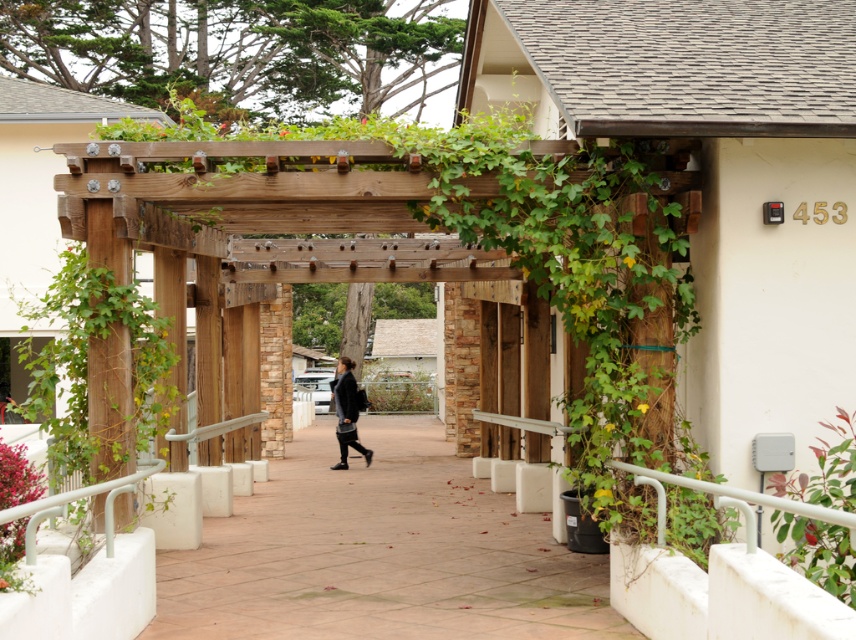
Question: Is the position of paved concrete walkway at center more distant than that of dark gray fabric jacket at center?

Choices:
 (A) yes
 (B) no

Answer: (B)

Question: Is green vine at center bigger than dark gray fabric jacket at center?

Choices:
 (A) yes
 (B) no

Answer: (A)

Question: Does paved concrete walkway at center lie behind green vine at center?

Choices:
 (A) no
 (B) yes

Answer: (A)

Question: Considering the real-world distances, which object is closest to the green leafy plant at lower right?

Choices:
 (A) dark gray fabric jacket at center
 (B) green vine at center

Answer: (B)

Question: Which point appears closest to the camera in this image?

Choices:
 (A) (x=843, y=410)
 (B) (x=58, y=284)
 (C) (x=562, y=566)
 (D) (x=349, y=384)

Answer: (A)

Question: Which point is closer to the camera?

Choices:
 (A) (401, 467)
 (B) (343, 403)

Answer: (B)